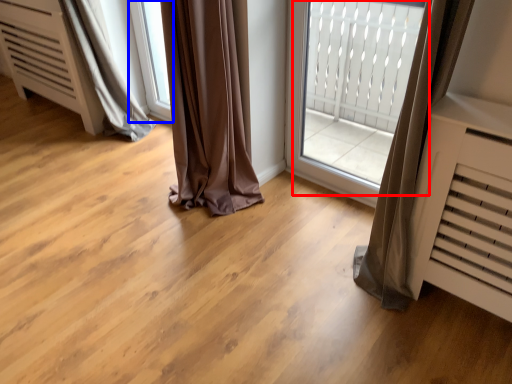
Question: Among these objects, which one is nearest to the camera, bay window (highlighted by a red box) or window (highlighted by a blue box)?

Choices:
 (A) bay window
 (B) window

Answer: (A)